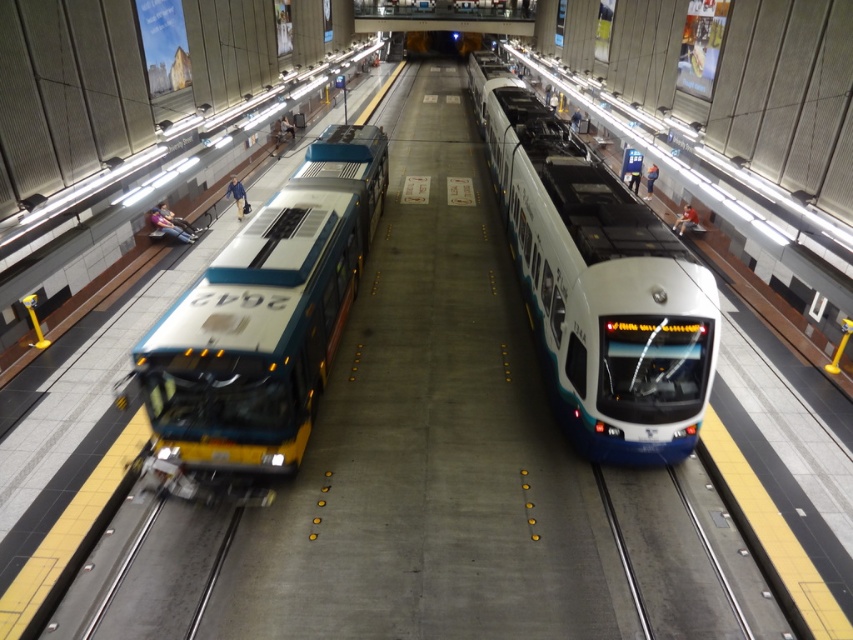
Is white glossy train at center behind teal glossy bus at left?

That is True.

Which of these two, white glossy train at center or teal glossy bus at left, stands shorter?

Standing shorter between the two is teal glossy bus at left.

Locate an element on the screen. white glossy train at center is located at coordinates (598, 284).

Locate an element on the screen. white glossy train at center is located at coordinates (598, 284).